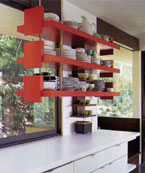
Locate an element on the screen. red shelf is located at coordinates (81, 34), (69, 60), (74, 93).